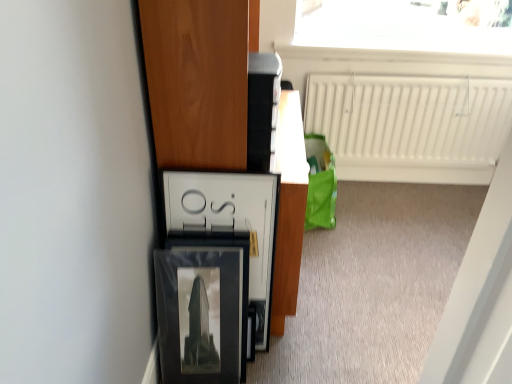
Where is `wooden cabinet at left`? wooden cabinet at left is located at coordinates (198, 79).

What do you see at coordinates (199, 316) in the screenshot?
I see `matte black picture frame at lower left` at bounding box center [199, 316].

What is the approximate width of white matte radiator at upper right?

The width of white matte radiator at upper right is 7.39 inches.

Measure the distance between point (163,177) and camera.

Point (163,177) is 1.26 meters away from camera.

Identify the location of wooden cabinet at left. [x=198, y=79].

From a real-world perspective, is matte black picture frame at lower left below white matte radiator at upper right?

Correct, in the physical world, matte black picture frame at lower left is lower than white matte radiator at upper right.

Considering the relative sizes of matte black picture frame at lower left and white matte radiator at upper right in the image provided, is matte black picture frame at lower left shorter than white matte radiator at upper right?

Yes.

Which point is more forward, (196, 261) or (498, 101)?

The point (196, 261) is closer.

Between matte black picture frame at lower left and white matte radiator at upper right, which one has smaller width?

Thinner between the two is white matte radiator at upper right.

Does wooden cabinet at left have a larger size compared to matte black picture frame at lower left?

Indeed, wooden cabinet at left has a larger size compared to matte black picture frame at lower left.

What's the angular difference between wooden cabinet at left and matte black picture frame at lower left's facing directions?

They differ by 1.32 degrees in their facing directions.

Considering the positions of point (281, 223) and point (218, 327), is point (281, 223) closer or farther from the camera than point (218, 327)?

Point (281, 223).

Which object is closer to the camera taking this photo, white glossy frame at center or wooden cabinet at left?

Positioned in front is wooden cabinet at left.

From a real-world perspective, which is physically below, white glossy frame at center or wooden cabinet at left?

From a 3D spatial view, white glossy frame at center is below.

Considering the relative sizes of white glossy frame at center and wooden cabinet at left in the image provided, is white glossy frame at center smaller than wooden cabinet at left?

Yes, white glossy frame at center is smaller than wooden cabinet at left.

Is white glossy frame at center next to wooden cabinet at left?

No, white glossy frame at center is not in contact with wooden cabinet at left.

The width and height of the screenshot is (512, 384). I want to click on cabinetry below the wooden cabinet at left (from the image's perspective), so click(230, 223).

Between wooden cabinet at left and white glossy frame at center, which one is positioned behind?

white glossy frame at center is further from the camera.

Considering the sizes of objects wooden cabinet at left and white glossy frame at center in the image provided, who is smaller, wooden cabinet at left or white glossy frame at center?

Smaller between the two is white glossy frame at center.

Looking at this image, would you say white glossy frame at center is part of wooden cabinet at left's contents?

Yes, wooden cabinet at left contains white glossy frame at center.

In the scene shown: From the image's perspective, relative to matte black picture frame at lower left, is white glossy frame at center above or below?

Based on their image positions, white glossy frame at center is located above matte black picture frame at lower left.

From a real-world perspective, is white glossy frame at center positioned under matte black picture frame at lower left based on gravity?

No, from a real-world perspective, white glossy frame at center is not below matte black picture frame at lower left.

Considering the positions of objects white glossy frame at center and matte black picture frame at lower left in the image provided, who is in front, white glossy frame at center or matte black picture frame at lower left?

Positioned in front is matte black picture frame at lower left.

From their relative heights in the image, would you say matte black picture frame at lower left is taller or shorter than white glossy frame at center?

Clearly, matte black picture frame at lower left is shorter compared to white glossy frame at center.

In the image, is matte black picture frame at lower left on the left side or the right side of white glossy frame at center?

In the image, matte black picture frame at lower left appears on the left side of white glossy frame at center.

Based on the photo, are matte black picture frame at lower left and white glossy frame at center located far from each other?

No, matte black picture frame at lower left is in close proximity to white glossy frame at center.

Is matte black picture frame at lower left not inside white glossy frame at center?

That's correct, matte black picture frame at lower left is outside of white glossy frame at center.

Find the location of `cabinetry on the left of white matte radiator at upper right`. cabinetry on the left of white matte radiator at upper right is located at coordinates point(230,223).

From the image's perspective, which is above, white glossy frame at center or white matte radiator at upper right?

white matte radiator at upper right is shown above in the image.

Is white matte radiator at upper right completely or partially inside white glossy frame at center?

That's incorrect, white matte radiator at upper right is not inside white glossy frame at center.

In the scene shown: Can you tell me how much white glossy frame at center and white matte radiator at upper right differ in facing direction?

There is a 3.54-degree angle between the facing directions of white glossy frame at center and white matte radiator at upper right.

This screenshot has width=512, height=384. I want to click on radiator that is above the matte black picture frame at lower left (from a real-world perspective), so click(410, 126).

Locate an element on the screen. furniture to the right of matte black picture frame at lower left is located at coordinates (198, 79).

Looking at the image, which one is located further to white matte radiator at upper right, matte black picture frame at lower left or wooden cabinet at left?

Based on the image, matte black picture frame at lower left appears to be further to white matte radiator at upper right.

When comparing their distances from white glossy frame at center, does wooden cabinet at left or matte black picture frame at lower left seem closer?

The object closer to white glossy frame at center is wooden cabinet at left.

Based on their spatial positions, is white matte radiator at upper right or matte black picture frame at lower left closer to wooden cabinet at left?

matte black picture frame at lower left is closer to wooden cabinet at left.

Estimate the real-world distances between objects in this image. Which object is further from matte black picture frame at lower left, white glossy frame at center or wooden cabinet at left?

The object further to matte black picture frame at lower left is wooden cabinet at left.

Considering their positions, is white matte radiator at upper right positioned closer to white glossy frame at center than matte black picture frame at lower left?

matte black picture frame at lower left is closer to white glossy frame at center.

Looking at the image, which one is located further to wooden cabinet at left, matte black picture frame at lower left or white matte radiator at upper right?

white matte radiator at upper right is positioned further to the anchor wooden cabinet at left.

Which object lies nearer to the anchor point matte black picture frame at lower left, white matte radiator at upper right or white glossy frame at center?

Based on the image, white glossy frame at center appears to be nearer to matte black picture frame at lower left.

Estimate the real-world distances between objects in this image. Which object is further from wooden cabinet at left, white matte radiator at upper right or white glossy frame at center?

Based on the image, white matte radiator at upper right appears to be further to wooden cabinet at left.

Where is `cabinetry between matte black picture frame at lower left and white matte radiator at upper right from left to right`? This screenshot has height=384, width=512. cabinetry between matte black picture frame at lower left and white matte radiator at upper right from left to right is located at coordinates (230, 223).

Locate an element on the screen. picture frame between wooden cabinet at left and white matte radiator at upper right along the z-axis is located at coordinates (199, 316).

Where is `cabinetry that lies between wooden cabinet at left and matte black picture frame at lower left from top to bottom`? The width and height of the screenshot is (512, 384). cabinetry that lies between wooden cabinet at left and matte black picture frame at lower left from top to bottom is located at coordinates (230, 223).

Where is `cabinetry between wooden cabinet at left and white matte radiator at upper right along the z-axis`? cabinetry between wooden cabinet at left and white matte radiator at upper right along the z-axis is located at coordinates (230, 223).